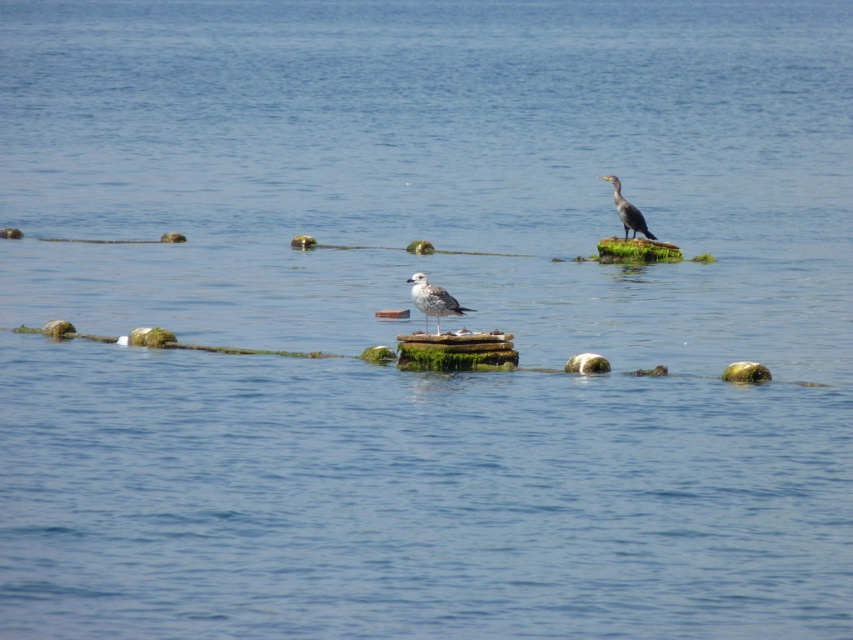
Between point (410, 292) and point (650, 236), which one is positioned behind?

Positioned behind is point (650, 236).

Can you confirm if white feathered bird at center is smaller than dark gray feathers at upper right?

Yes.

Image resolution: width=853 pixels, height=640 pixels. Describe the element at coordinates (433, 300) in the screenshot. I see `white feathered bird at center` at that location.

I want to click on white feathered bird at center, so click(x=433, y=300).